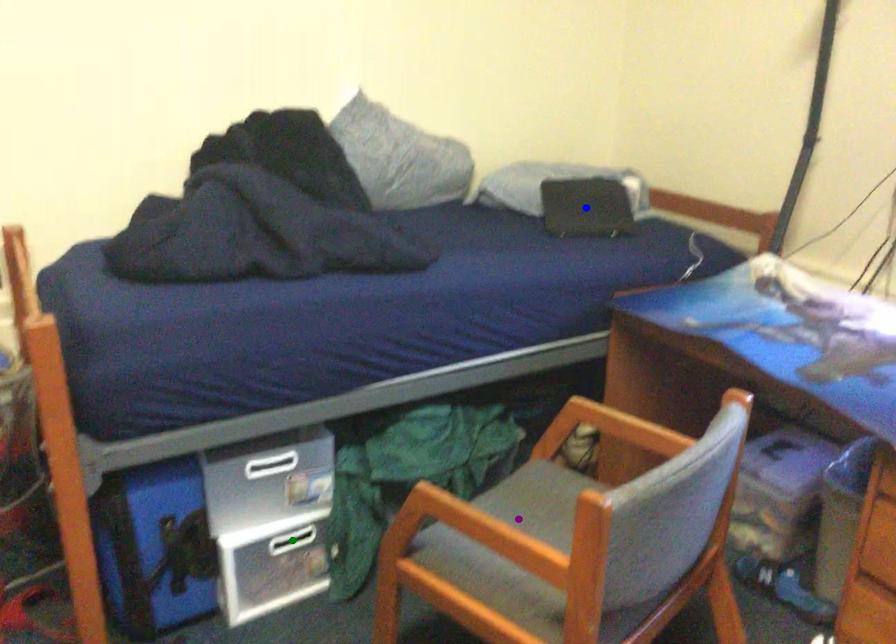
Order these from nearest to farthest:
1. green point
2. blue point
3. purple point

purple point, green point, blue point